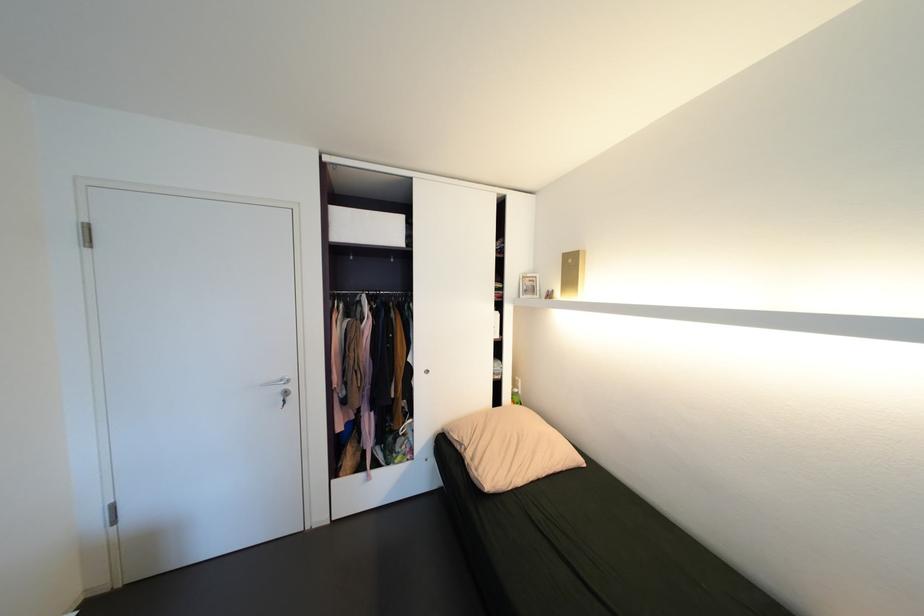
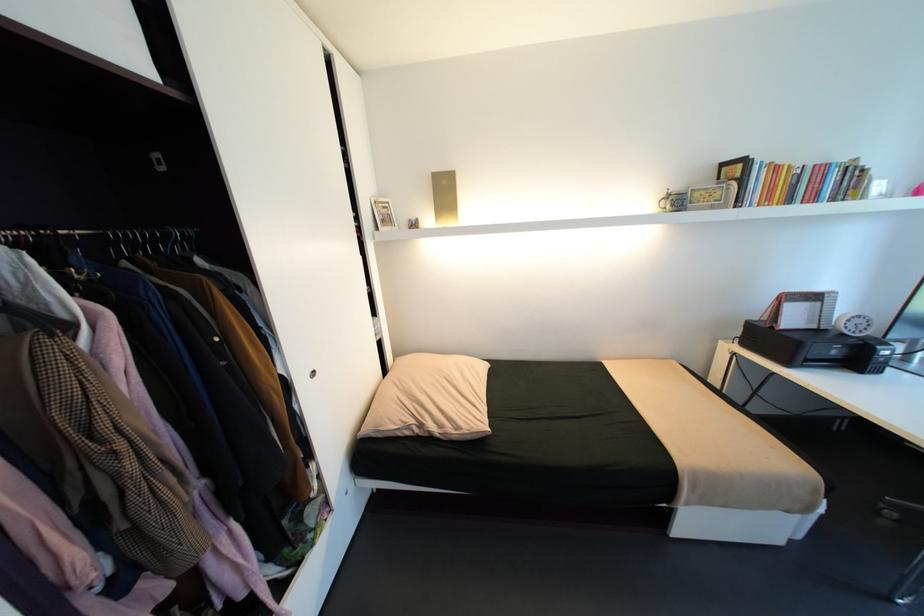
The point at (537, 282) is marked in the first image. Where is the corresponding point in the second image?

(392, 208)